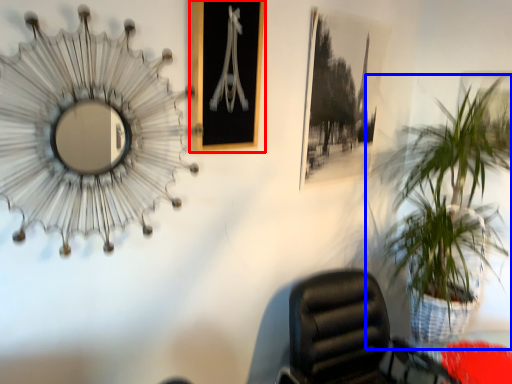
Question: Which object appears closest to the camera in this image, picture frame (highlighted by a red box) or houseplant (highlighted by a blue box)?

Choices:
 (A) picture frame
 (B) houseplant

Answer: (A)